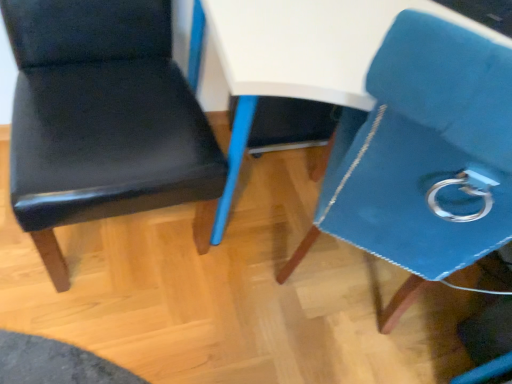
Question: In the image, is matte black chair at left, placed as the 1th chair when sorted from left to right, on the left side or the right side of blue leather chair at upper right, the first chair viewed from the right?

Choices:
 (A) right
 (B) left

Answer: (B)

Question: Is point (122, 168) closer or farther from the camera than point (339, 235)?

Choices:
 (A) farther
 (B) closer

Answer: (B)

Question: Is matte black chair at left, arranged as the second chair when viewed from the right, inside or outside of blue leather chair at upper right, the 2th chair from the left?

Choices:
 (A) outside
 (B) inside

Answer: (A)

Question: Based on their positions, is blue leather chair at upper right, the 2th chair from the left, located to the left or right of matte black chair at left, placed as the 1th chair when sorted from left to right?

Choices:
 (A) right
 (B) left

Answer: (A)

Question: Considering their positions, is blue leather chair at upper right, the 2th chair from the left, located in front of or behind matte black chair at left, arranged as the second chair when viewed from the right?

Choices:
 (A) behind
 (B) front

Answer: (B)

Question: From the image's perspective, is blue leather chair at upper right, the 2th chair from the left, positioned above or below matte black chair at left, placed as the 1th chair when sorted from left to right?

Choices:
 (A) below
 (B) above

Answer: (A)

Question: In terms of width, does blue leather chair at upper right, the 2th chair from the left, look wider or thinner when compared to matte black chair at left, arranged as the second chair when viewed from the right?

Choices:
 (A) thin
 (B) wide

Answer: (B)